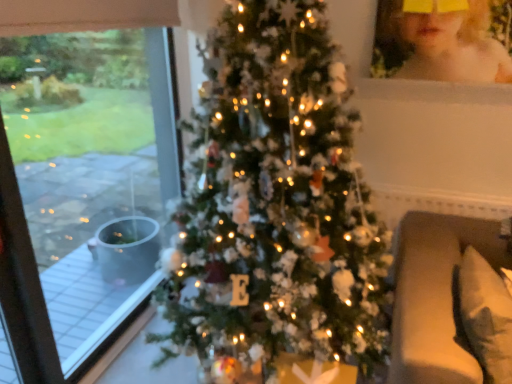
Question: From a real-world perspective, is blonde hair at upper right located beneath green matte christmas tree at center?

Choices:
 (A) no
 (B) yes

Answer: (A)

Question: Is the depth of blonde hair at upper right less than that of green matte christmas tree at center?

Choices:
 (A) no
 (B) yes

Answer: (A)

Question: Does blonde hair at upper right turn towards green matte christmas tree at center?

Choices:
 (A) yes
 (B) no

Answer: (B)

Question: From a real-world perspective, is blonde hair at upper right on top of green matte christmas tree at center?

Choices:
 (A) yes
 (B) no

Answer: (A)

Question: Would you say green matte christmas tree at center is part of blonde hair at upper right's contents?

Choices:
 (A) yes
 (B) no

Answer: (B)

Question: Does blonde hair at upper right have a greater width compared to green matte christmas tree at center?

Choices:
 (A) no
 (B) yes

Answer: (A)

Question: From the image's perspective, does blonde hair at upper right appear higher than white soft pillow at lower right?

Choices:
 (A) yes
 (B) no

Answer: (A)

Question: Does blonde hair at upper right turn towards white soft pillow at lower right?

Choices:
 (A) yes
 (B) no

Answer: (B)

Question: Does blonde hair at upper right have a smaller size compared to white soft pillow at lower right?

Choices:
 (A) yes
 (B) no

Answer: (A)

Question: Is blonde hair at upper right oriented away from white soft pillow at lower right?

Choices:
 (A) yes
 (B) no

Answer: (B)

Question: Would you say white soft pillow at lower right is part of blonde hair at upper right's contents?

Choices:
 (A) no
 (B) yes

Answer: (A)

Question: Is the depth of blonde hair at upper right less than that of white soft pillow at lower right?

Choices:
 (A) no
 (B) yes

Answer: (A)

Question: Considering the relative sizes of transparent glass window at left and white soft pillow at lower right in the image provided, is transparent glass window at left wider than white soft pillow at lower right?

Choices:
 (A) no
 (B) yes

Answer: (A)